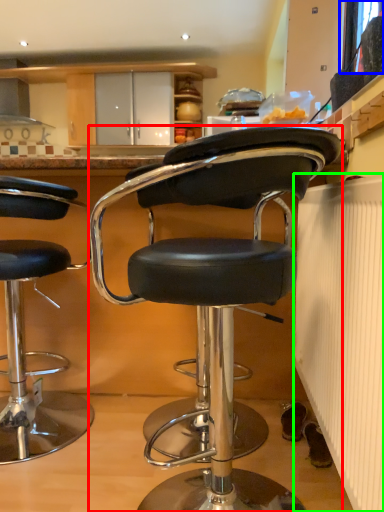
Question: Considering the real-world distances, which object is farthest from chair (highlighted by a red box)? window screen (highlighted by a blue box) or radiator (highlighted by a green box)?

Choices:
 (A) window screen
 (B) radiator

Answer: (A)